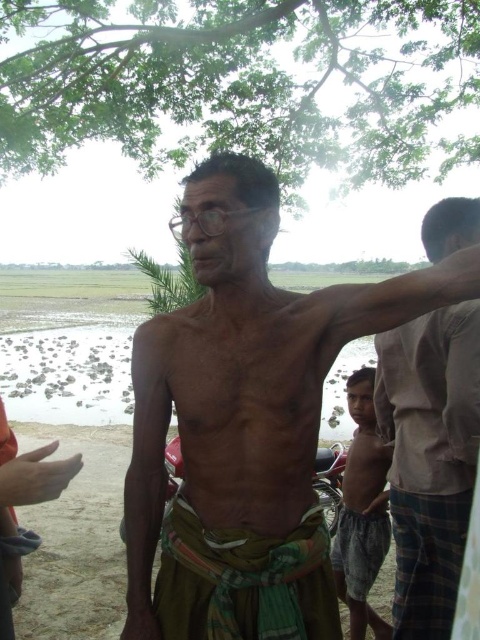
What do you see at coordinates (245, 420) in the screenshot? I see `brown skin man at center` at bounding box center [245, 420].

Can you confirm if brown skin man at center is positioned to the left of green leafy tree at upper center?

No, brown skin man at center is not to the left of green leafy tree at upper center.

Which is behind, point (288, 385) or point (388, 1)?

Positioned behind is point (388, 1).

Identify the location of brown skin man at center. Image resolution: width=480 pixels, height=640 pixels. (245, 420).

Consider the image. Is green leafy tree at upper center further to camera compared to gray cotton shirt at right?

Yes, it is behind gray cotton shirt at right.

Can you confirm if green leafy tree at upper center is positioned above gray cotton shirt at right?

Indeed, green leafy tree at upper center is positioned over gray cotton shirt at right.

The image size is (480, 640). Find the location of `green leafy tree at upper center`. green leafy tree at upper center is located at coordinates (237, 81).

Does brown skin man at center appear on the right side of gray cotton shirt at right?

No, brown skin man at center is not to the right of gray cotton shirt at right.

Does brown skin man at center have a lesser width compared to gray cotton shirt at right?

In fact, brown skin man at center might be wider than gray cotton shirt at right.

Where is `brown skin man at center`? This screenshot has height=640, width=480. brown skin man at center is located at coordinates (245, 420).

You are a GUI agent. You are given a task and a screenshot of the screen. Output one action in this format:
    pyautogui.click(x=<x>, y=<y>)
    Task: Click on the brown skin man at center
    The height and width of the screenshot is (640, 480).
    Given the screenshot: What is the action you would take?
    (245, 420)